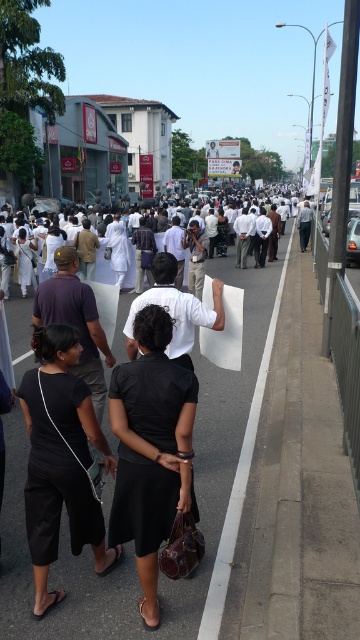
Consider the image. Who is higher up, white cloth crowd at center or matte black dress at center?

white cloth crowd at center is higher up.

Identify the location of white cloth crowd at center. (102, 266).

The image size is (360, 640). Describe the element at coordinates (60, 460) in the screenshot. I see `black matte pants at lower left` at that location.

Measure the distance between black matte pants at lower left and white cloth crowd at center.

black matte pants at lower left is 32.51 feet from white cloth crowd at center.

Which is in front, point (82, 404) or point (102, 241)?

Point (82, 404) is in front.

The width and height of the screenshot is (360, 640). I want to click on black matte pants at lower left, so click(x=60, y=460).

Can you confirm if asphalt pavement at center is wider than black matte pants at lower left?

Yes.

Is asphalt pavement at center below black matte pants at lower left?

Incorrect, asphalt pavement at center is not positioned below black matte pants at lower left.

Based on the photo, who is more forward, (x=24, y=353) or (x=51, y=472)?

Point (x=51, y=472)

Locate an element on the screen. Image resolution: width=360 pixels, height=640 pixels. asphalt pavement at center is located at coordinates (221, 438).